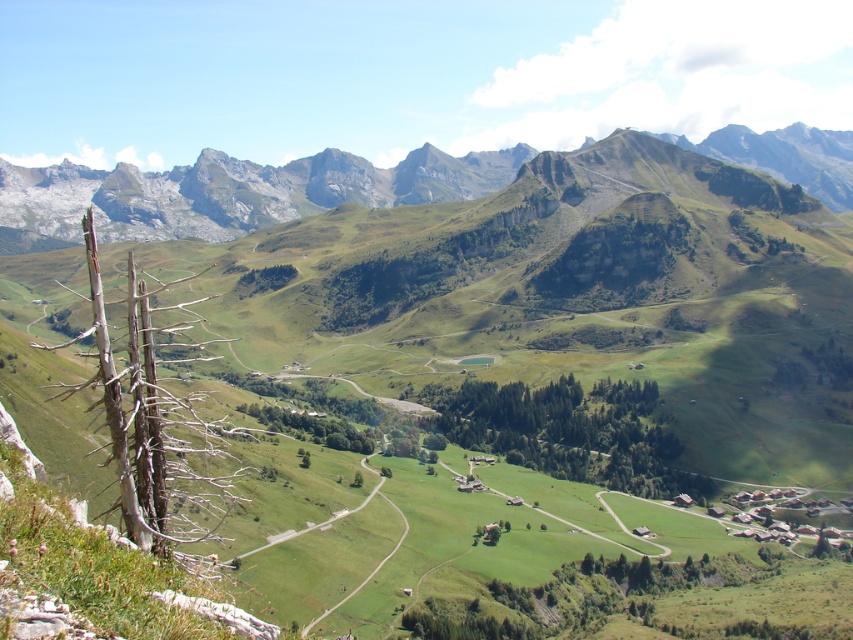
Is rugged stone mountain range at upper center taller than green leafy trees at center?

Correct, rugged stone mountain range at upper center is much taller as green leafy trees at center.

Which is behind, point (682, 141) or point (689, 488)?

The point (682, 141) is behind.

Image resolution: width=853 pixels, height=640 pixels. I want to click on rugged stone mountain range at upper center, so click(x=238, y=192).

Based on the photo, who is more distant from viewer, (381, 188) or (193, 492)?

Point (381, 188)

In order to click on rugged stone mountain range at upper center in this screenshot , I will do `click(238, 192)`.

Locate an element on the screen. rugged stone mountain range at upper center is located at coordinates (238, 192).

Is dead wood at left smaller than green leafy trees at center?

Actually, dead wood at left might be larger than green leafy trees at center.

Is dead wood at left to the left of green leafy trees at center from the viewer's perspective?

Indeed, dead wood at left is positioned on the left side of green leafy trees at center.

Describe the element at coordinates (152, 420) in the screenshot. The height and width of the screenshot is (640, 853). I see `dead wood at left` at that location.

This screenshot has width=853, height=640. In order to click on dead wood at left in this screenshot , I will do `click(152, 420)`.